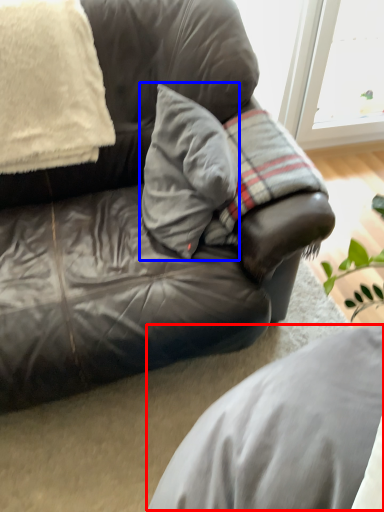
Question: Which object is closer to the camera taking this photo, gray (highlighted by a red box) or pillow (highlighted by a blue box)?

Choices:
 (A) gray
 (B) pillow

Answer: (A)